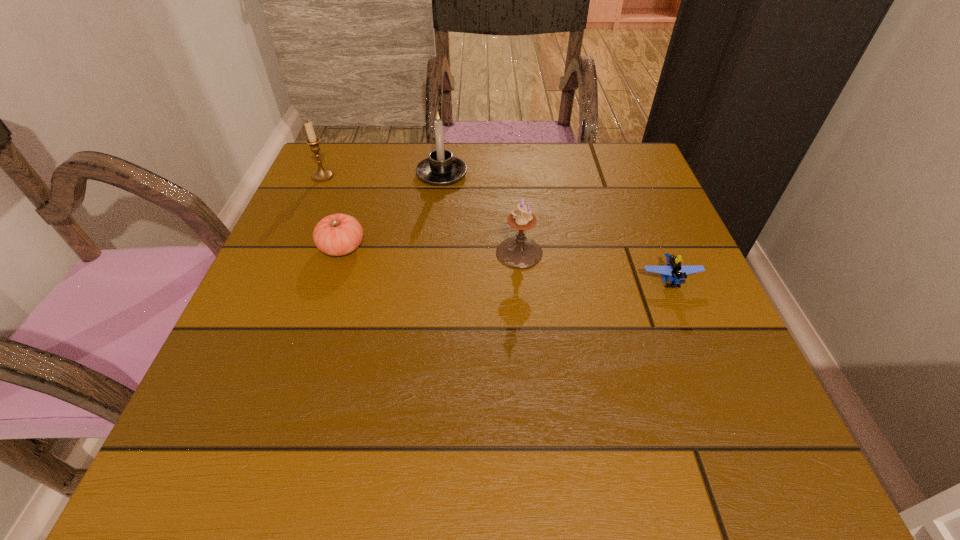
Locate an element on the screen. This screenshot has width=960, height=540. free area in between the rightmost candle holder and the leftmost object is located at coordinates (421, 214).

Where is `object that ranks as the second closest to the second candle holder from left to right`? object that ranks as the second closest to the second candle holder from left to right is located at coordinates (519, 252).

Choose which object is the fourth nearest neighbor to the tomato. Please provide its 2D coordinates. Your answer should be formatted as a tuple, i.e. [(x, y)], where the tuple contains the x and y coordinates of a point satisfying the conditions above.

[(676, 273)]

I want to click on the closest candle holder to the second candle holder from left to right, so click(x=519, y=252).

Identify which candle holder is located as the second nearest to the second object from right to left. Please provide its 2D coordinates. Your answer should be formatted as a tuple, i.e. [(x, y)], where the tuple contains the x and y coordinates of a point satisfying the conditions above.

[(321, 175)]